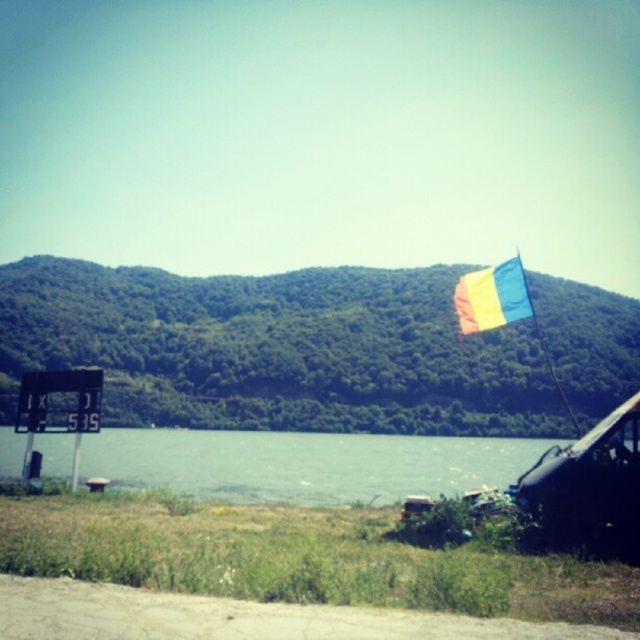
Question: Is clear water at center positioned in front of multicolored fabric flag at upper right?

Choices:
 (A) no
 (B) yes

Answer: (A)

Question: Can you confirm if clear water at center is positioned above multicolored fabric flag at upper right?

Choices:
 (A) yes
 (B) no

Answer: (B)

Question: Among these points, which one is farthest from the camera?

Choices:
 (A) (324, 454)
 (B) (515, 285)

Answer: (A)

Question: Is clear water at center above multicolored fabric flag at upper right?

Choices:
 (A) no
 (B) yes

Answer: (A)